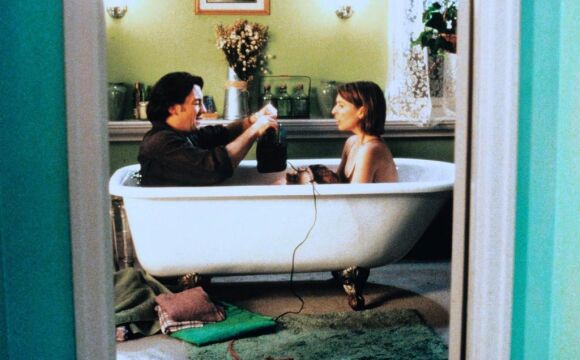
At what (x,y) coordinates should I click in order to perform the action: click on pink towel. Please return your answer as a coordinate pair (x, y). Image resolution: width=580 pixels, height=360 pixels. Looking at the image, I should click on [184, 302].